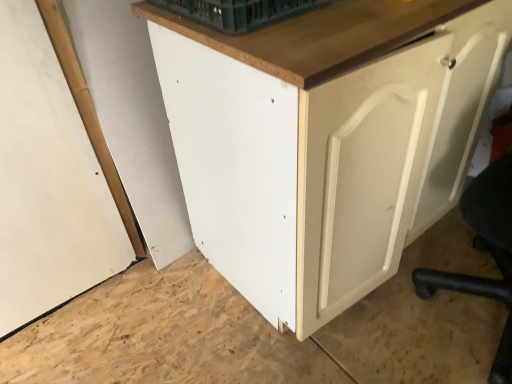
Question: In the image, is matte white cabinet at center on the left side or the right side of white matte door at right?

Choices:
 (A) left
 (B) right

Answer: (A)

Question: Considering the positions of point (206, 182) and point (475, 132), is point (206, 182) closer or farther from the camera than point (475, 132)?

Choices:
 (A) closer
 (B) farther

Answer: (A)

Question: Which object is the closest to the matte white cabinet at center?

Choices:
 (A) green plastic basket at upper center
 (B) white matte door at right

Answer: (B)

Question: Estimate the real-world distances between objects in this image. Which object is farther from the white matte door at right?

Choices:
 (A) green plastic basket at upper center
 (B) matte white cabinet at center

Answer: (A)